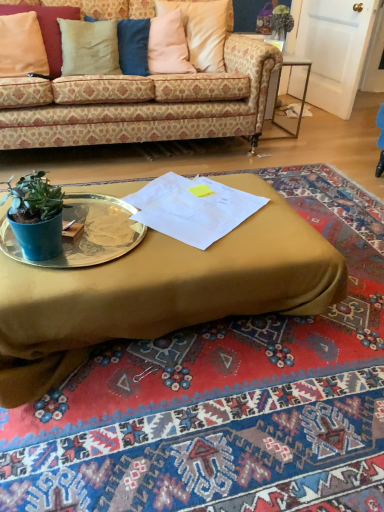
Question: Is pink fabric pillow at upper center, positioned as the first pillow in right-to-left order, bigger or smaller than metallic mirrored side table at right?

Choices:
 (A) big
 (B) small

Answer: (A)

Question: In terms of height, does pink fabric pillow at upper center, which is the 3th pillow from left to right, look taller or shorter compared to metallic mirrored side table at right?

Choices:
 (A) short
 (B) tall

Answer: (A)

Question: Estimate the real-world distances between objects in this image. Which object is farther from the metallic mirrored side table at right?

Choices:
 (A) patterned fabric couch at upper center
 (B) pink fabric pillow at upper center, positioned as the first pillow in right-to-left order
 (C) metallic silver platter at center
 (D) beige fabric pillow at upper left, placed as the third pillow when sorted from right to left
 (E) matte gold coffee table at center

Answer: (C)

Question: Which is nearer to the metallic mirrored side table at right?

Choices:
 (A) matte gold coffee table at center
 (B) beige fabric pillow at upper left, placed as the third pillow when sorted from right to left
 (C) pink fabric pillow at upper center, positioned as the first pillow in right-to-left order
 (D) beige fabric pillow at upper left, which is the second pillow from right to left
 (E) metallic silver platter at center

Answer: (C)